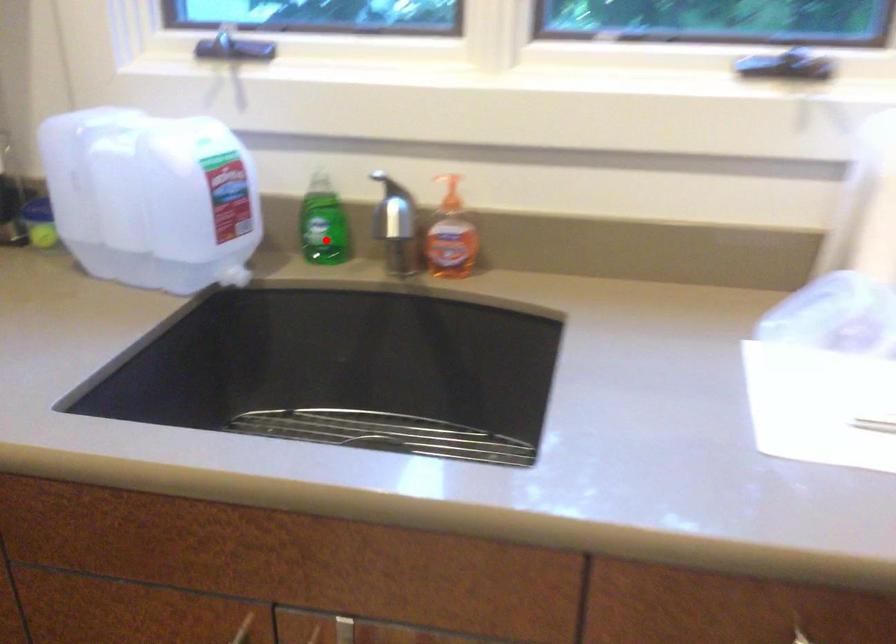
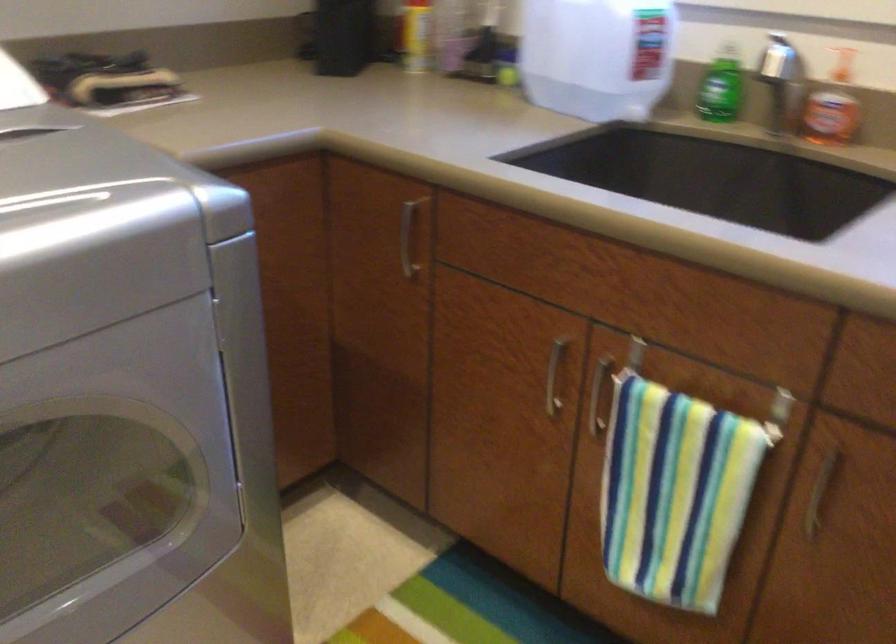
Find the pixel in the second image that matches the highlighted location in the first image.

(718, 105)